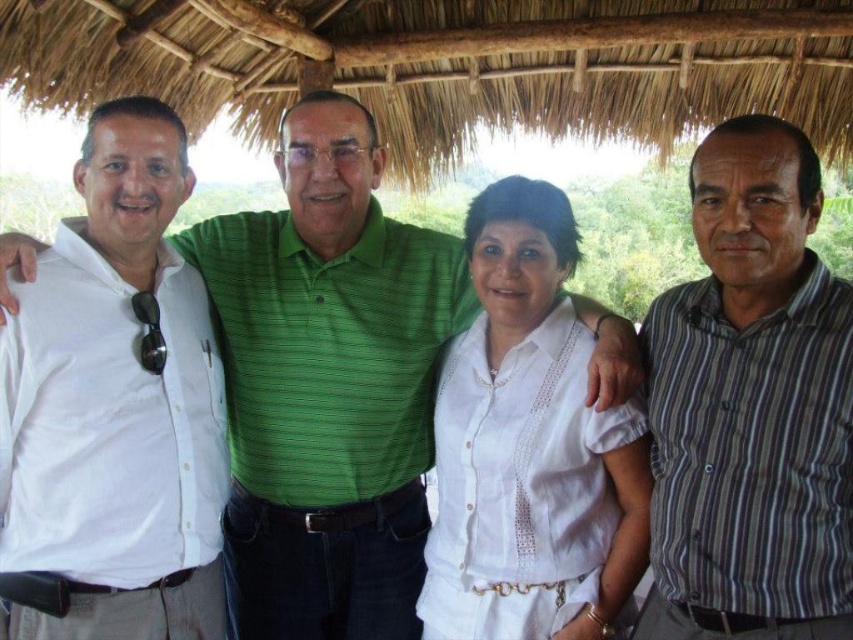
Is white shirt at center taller than white cotton blouse at center?

Indeed, white shirt at center has a greater height compared to white cotton blouse at center.

Which is above, white shirt at center or white cotton blouse at center?

white shirt at center is higher up.

Does point (189, 240) come farther from viewer compared to point (508, 225)?

Yes, it is.

Locate an element on the screen. white shirt at center is located at coordinates (328, 385).

Is striped cotton shirt at right taller than white cotton blouse at center?

In fact, striped cotton shirt at right may be shorter than white cotton blouse at center.

Does striped cotton shirt at right have a larger size compared to white cotton blouse at center?

Indeed, striped cotton shirt at right has a larger size compared to white cotton blouse at center.

From the picture: Who is more distant from viewer, [792,330] or [498,433]?

Positioned behind is point [498,433].

This screenshot has width=853, height=640. What are the coordinates of `striped cotton shirt at right` in the screenshot? It's located at coord(751,406).

Who is lower down, white shirt at center or striped cotton shirt at right?

striped cotton shirt at right is lower down.

Based on the photo, does white shirt at center come in front of striped cotton shirt at right?

No, white shirt at center is further to the viewer.

Where is `white shirt at center`? This screenshot has height=640, width=853. white shirt at center is located at coordinates (328, 385).